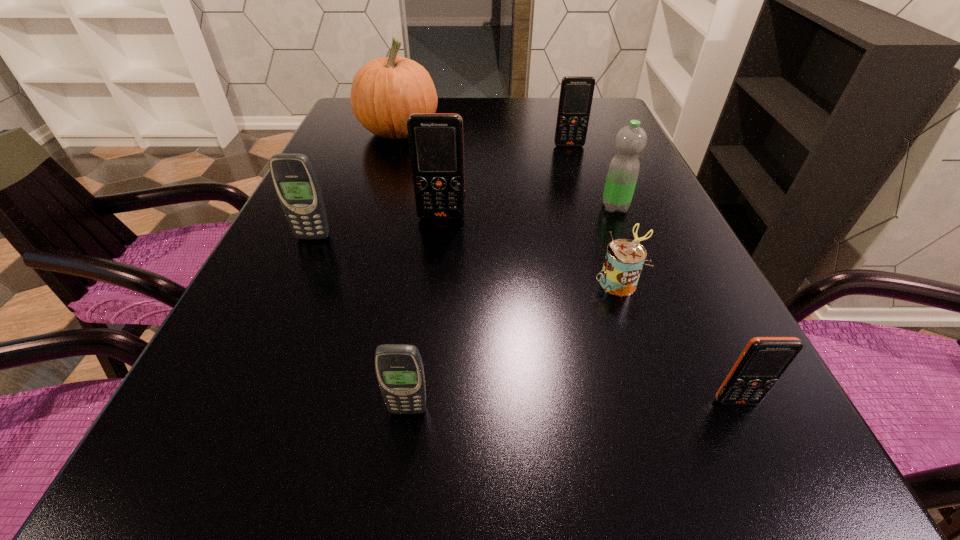
You are a GUI agent. You are given a task and a screenshot of the screen. Output one action in this format:
    pyautogui.click(x=<x>, y=<y>)
    Task: Click on the vacant space at the left edge
    This screenshot has height=540, width=960.
    Given the screenshot: What is the action you would take?
    191,393

The height and width of the screenshot is (540, 960). In order to click on vacant space at the right edge of the desktop in this screenshot , I will do `click(631, 232)`.

Where is `vacant point located between the tallest cellular telephone and the green water bottle`? The image size is (960, 540). vacant point located between the tallest cellular telephone and the green water bottle is located at coordinates (528, 212).

At what (x,y) coordinates should I click in order to perform the action: click on free area in between the nearer gray cellular telephone and the rightmost orange cellular telephone. Please return your answer as a coordinate pair (x, y). This screenshot has height=540, width=960. Looking at the image, I should click on (572, 406).

Where is `free space between the rightmost object and the second farthest cellular telephone`? The width and height of the screenshot is (960, 540). free space between the rightmost object and the second farthest cellular telephone is located at coordinates (589, 309).

At what (x,y) coordinates should I click in order to perform the action: click on blank region between the shortest object and the smaller gray cellular telephone. Please return your answer as a coordinate pair (x, y). Image resolution: width=960 pixels, height=540 pixels. Looking at the image, I should click on (513, 346).

The width and height of the screenshot is (960, 540). I want to click on vacant point located between the shortest object and the farthest cellular telephone, so click(x=593, y=214).

Locate an element on the screen. The height and width of the screenshot is (540, 960). blank region between the farthest cellular telephone and the green water bottle is located at coordinates (592, 177).

I want to click on vacant area that lies between the water bottle and the fourth cellular telephone from left to right, so click(592, 177).

You are a GUI agent. You are given a task and a screenshot of the screen. Output one action in this format:
    pyautogui.click(x=<x>, y=<y>)
    Task: Click on the vacant point located between the leftmost orange cellular telephone and the rightmost orange cellular telephone
    
    Given the screenshot: What is the action you would take?
    pyautogui.click(x=589, y=309)